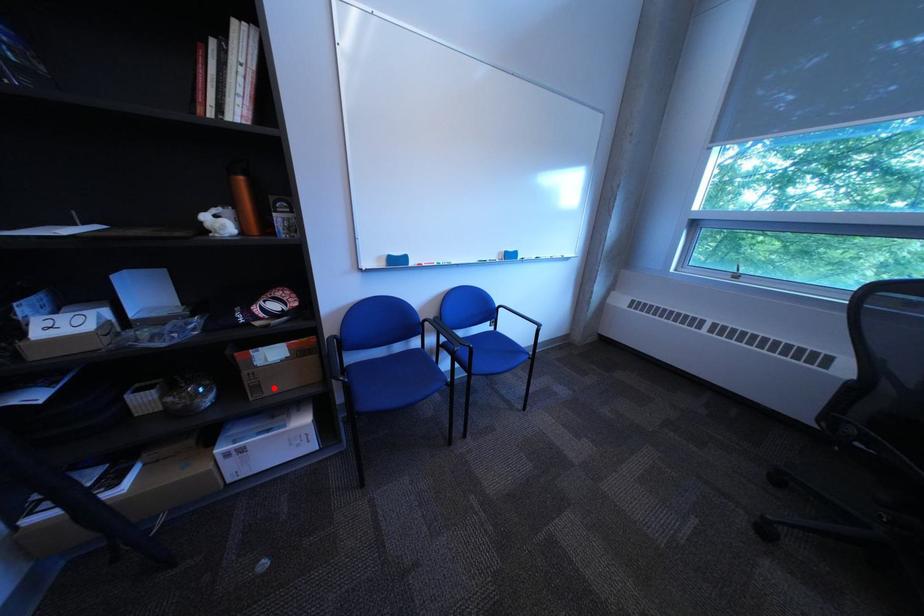
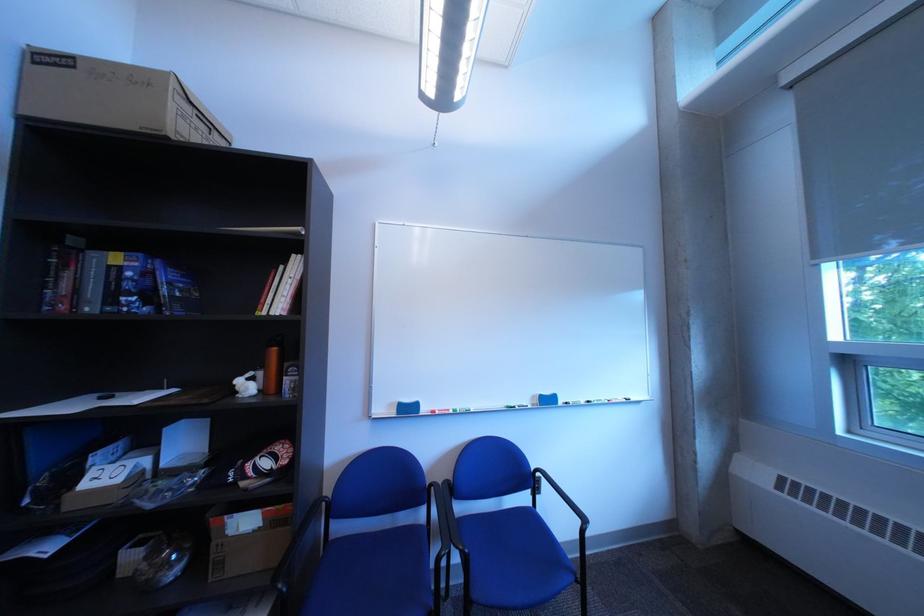
Question: I am providing you with two images of the same scene from different viewpoints. Given a red point in image1, look at the same physical point in image2. Is it:

Choices:
 (A) Closer to the viewpoint
 (B) Farther from the viewpoint

Answer: (B)